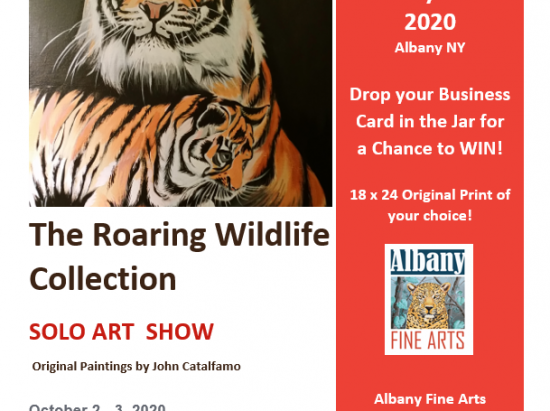
At what (x,y) coordinates should I click in order to perform the action: click on small poster inside the red background on the right side of photo. Please return your answer as a coordinate pair (x, y). Looking at the image, I should click on (425, 316).